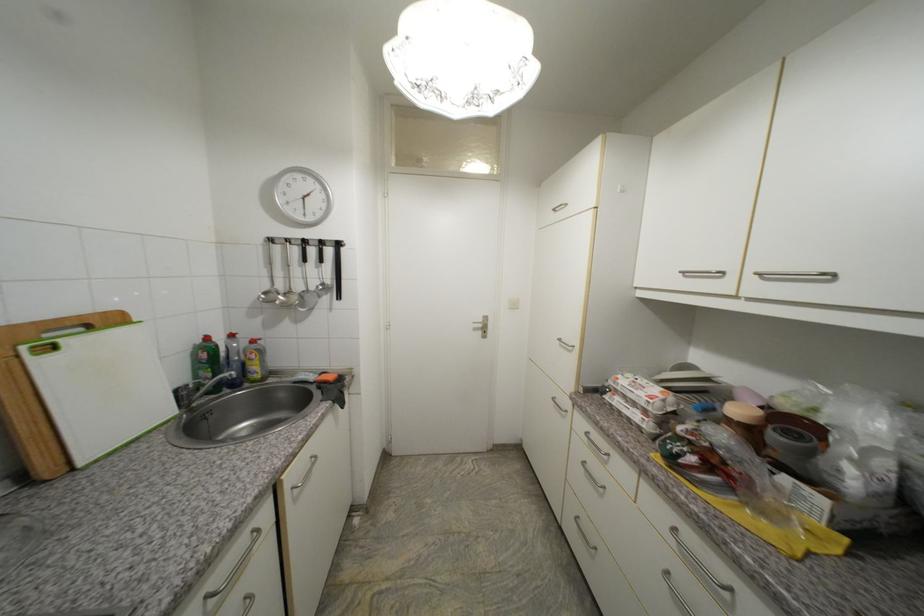
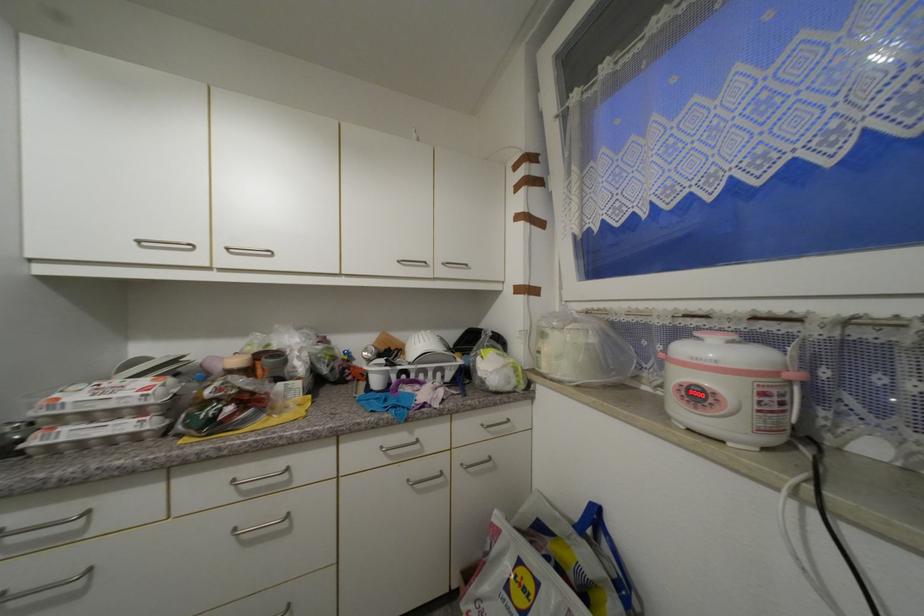
Question: Based on the continuous images, in which direction is the camera rotating? Reply with the corresponding letter.

Choices:
 (A) Left
 (B) Right
 (C) Up
 (D) Down

Answer: (B)